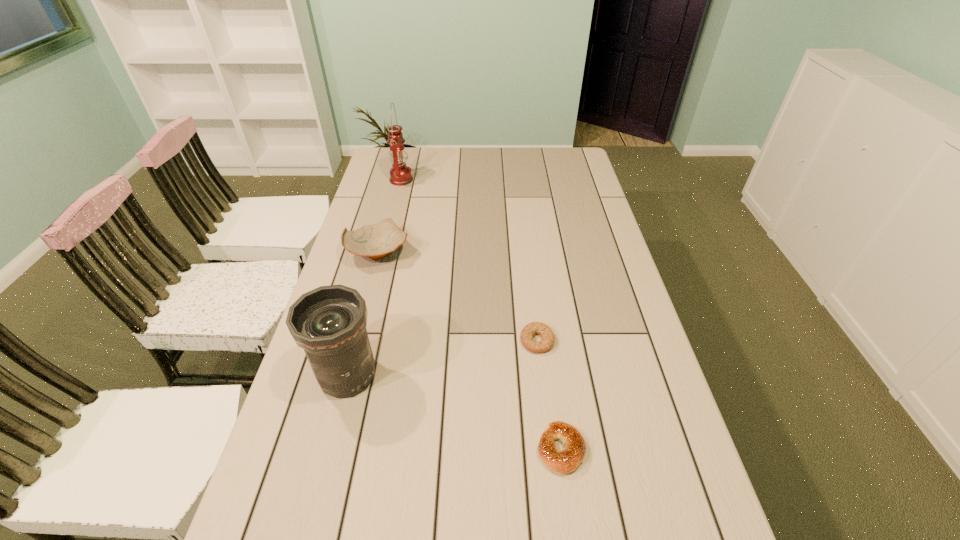
Point out which object is positioned as the fourth nearest to the fourth nearest object. Please provide its 2D coordinates. Your answer should be formatted as a tuple, i.e. [(x, y)], where the tuple contains the x and y coordinates of a point satisfying the conditions above.

[(565, 461)]

The width and height of the screenshot is (960, 540). I want to click on the fourth closest object to the farthest object, so pyautogui.click(x=565, y=461).